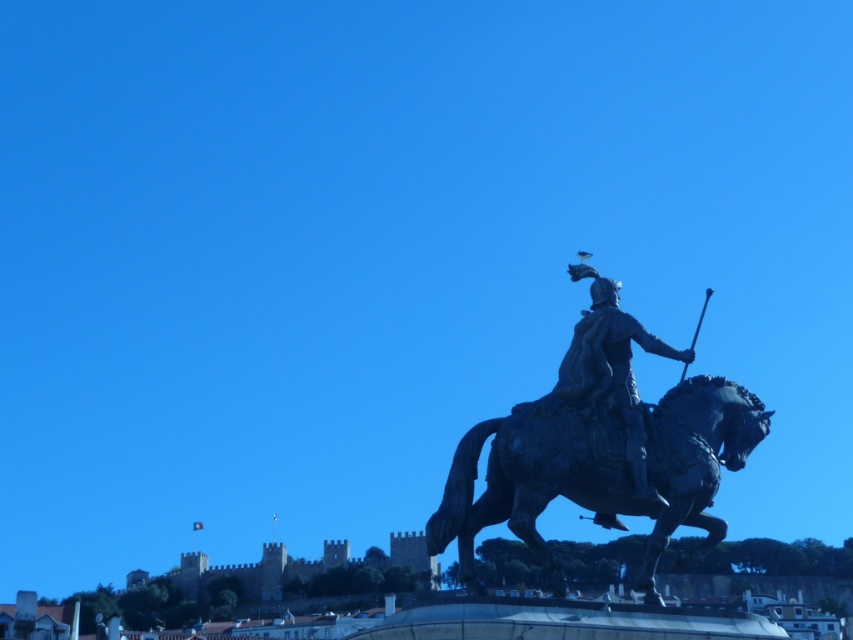
Question: Is shiny black horse at center to the left of polished bronze statue at center from the viewer's perspective?

Choices:
 (A) no
 (B) yes

Answer: (B)

Question: Does shiny black horse at center appear under polished bronze statue at center?

Choices:
 (A) no
 (B) yes

Answer: (B)

Question: Does shiny black horse at center lie behind polished bronze statue at center?

Choices:
 (A) yes
 (B) no

Answer: (B)